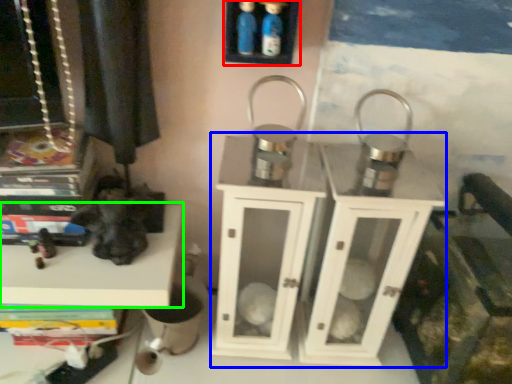
Question: Which object is positioned closest to shelf (highlighted by a red box)? Select from dresser (highlighted by a blue box) and shelf (highlighted by a green box).

Choices:
 (A) dresser
 (B) shelf

Answer: (A)